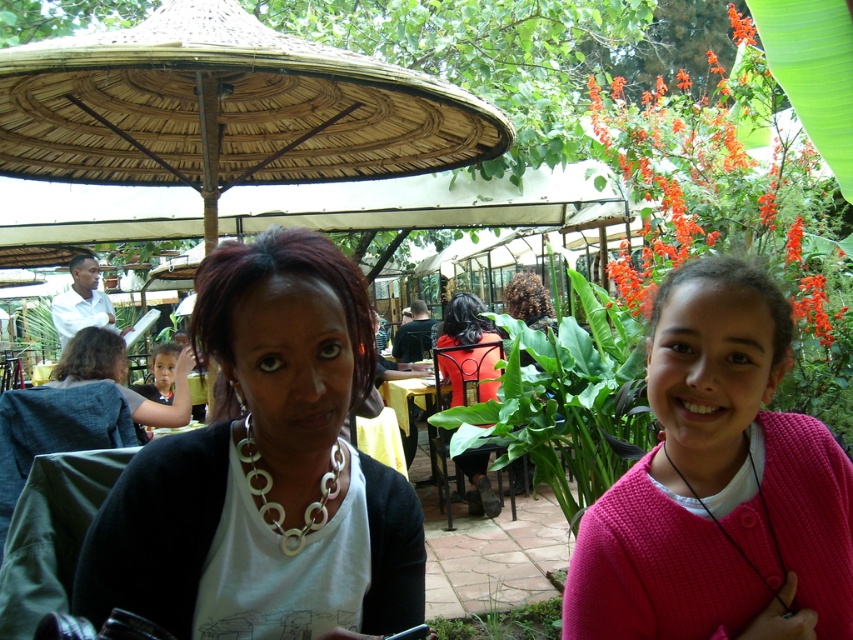
Question: Based on their relative distances, which object is nearer to the orange fabric chair at center?

Choices:
 (A) matte white necklace at center
 (B) thatched straw umbrella at upper center
 (C) black leather necklace at lower right
 (D) silver metallic necklace at center

Answer: (B)

Question: Which point is farther to the camera?

Choices:
 (A) matte white necklace at center
 (B) yellow fabric table at center

Answer: (B)

Question: Which of the following is the farthest from the observer?

Choices:
 (A) pink knitted sweater at center
 (B) orange fabric chair at center

Answer: (B)

Question: Does matte white necklace at center have a smaller size compared to black leather necklace at lower right?

Choices:
 (A) yes
 (B) no

Answer: (B)

Question: In this image, where is matte white necklace at center located relative to black leather necklace at lower right?

Choices:
 (A) left
 (B) right

Answer: (A)

Question: Can you confirm if matte white necklace at center is positioned below orange fabric chair at center?

Choices:
 (A) yes
 (B) no

Answer: (B)